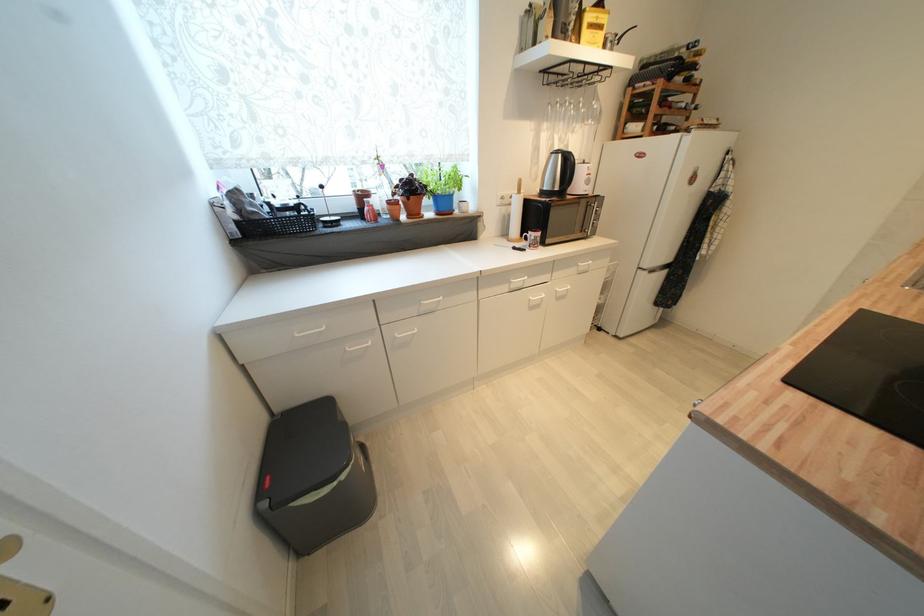
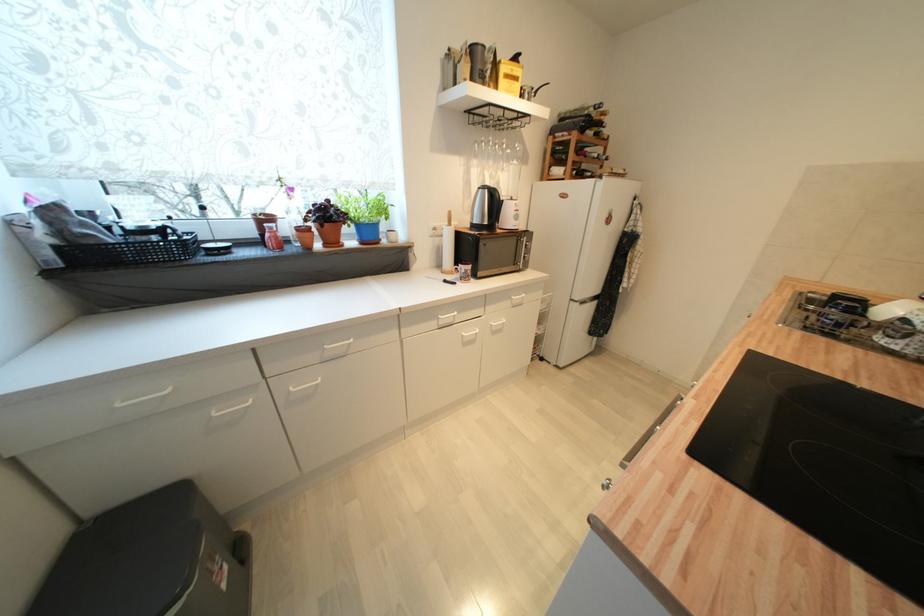
Question: I am providing you with two images of the same scene from different viewpoints. Please identify which objects are invisible in image2.

Choices:
 (A) blue plant pot
 (B) silver electric kettle
 (C) paper towel roll
 (D) none of these

Answer: (D)